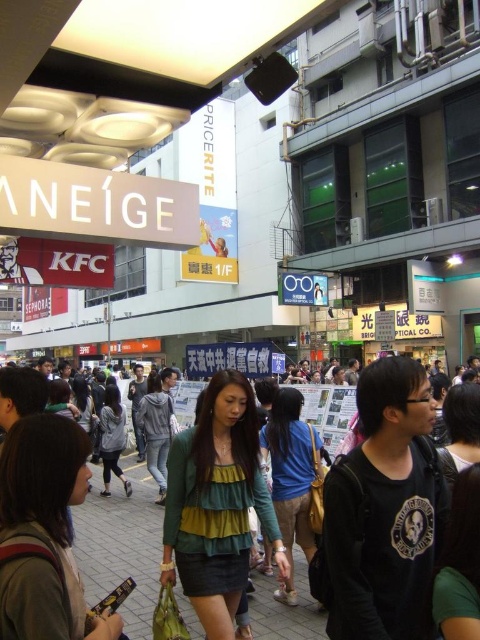
Which is above, green jersey at center or gray fabric jacket at center?

green jersey at center

Does green jersey at center lie in front of gray fabric jacket at center?

Yes, it is in front of gray fabric jacket at center.

The height and width of the screenshot is (640, 480). In order to click on green jersey at center in this screenshot , I will do `click(291, 476)`.

Does point (342, 608) come in front of point (479, 532)?

No, it is not.

What do you see at coordinates (384, 513) in the screenshot? I see `green fabric jacket at center` at bounding box center [384, 513].

The height and width of the screenshot is (640, 480). Describe the element at coordinates (384, 513) in the screenshot. I see `green fabric jacket at center` at that location.

Image resolution: width=480 pixels, height=640 pixels. Find the location of `green fabric jacket at center`. green fabric jacket at center is located at coordinates (384, 513).

Is point (136, 544) farther from viewer compared to point (6, 595)?

That is True.

Who is taller, green fabric jacket at center or matte gray shirt at lower left?

Standing taller between the two is green fabric jacket at center.

The image size is (480, 640). What are the coordinates of `green fabric jacket at center` in the screenshot? It's located at (384, 513).